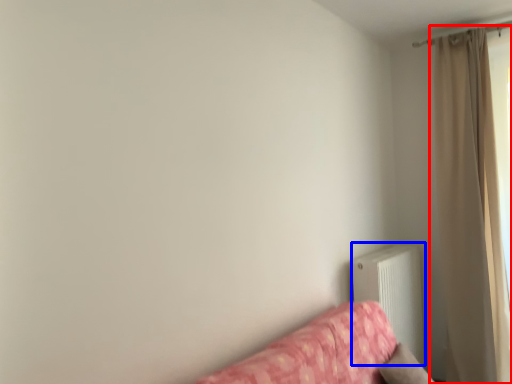
Question: Which object is closer to the camera taking this photo, curtain (highlighted by a red box) or radiator (highlighted by a blue box)?

Choices:
 (A) curtain
 (B) radiator

Answer: (B)